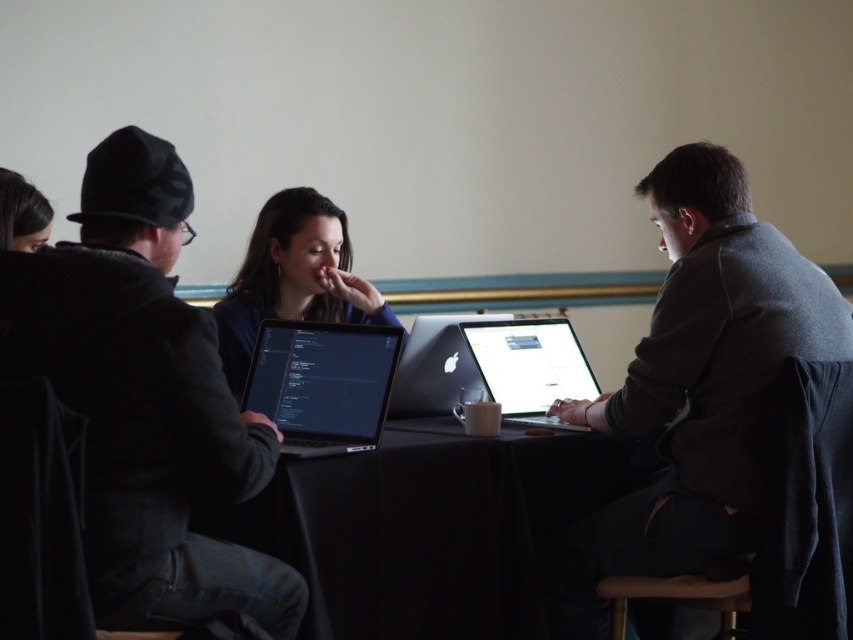
Does matte black jacket at left have a lesser width compared to black fabric table at center?

Indeed, matte black jacket at left has a lesser width compared to black fabric table at center.

Who is more distant from viewer, (109, 323) or (416, 433)?

Point (416, 433)

Image resolution: width=853 pixels, height=640 pixels. What are the coordinates of `matte black jacket at left` in the screenshot? It's located at (144, 400).

Which is behind, point (158, 416) or point (459, 314)?

Point (459, 314)

Is point (136, 499) positioned after point (456, 365)?

No, (136, 499) is in front of (456, 365).

Find the location of a particular element. matte black jacket at left is located at coordinates (144, 400).

Which is behind, point (410, 449) or point (315, 227)?

The point (315, 227) is more distant.

Is black fabric table at center below matte black laptop at center?

Correct, black fabric table at center is located below matte black laptop at center.

Who is more forward, (447,620) or (254,340)?

Point (447,620) is more forward.

At what (x,y) coordinates should I click in order to perform the action: click on black fabric table at center. Please return your answer as a coordinate pair (x, y). The height and width of the screenshot is (640, 853). Looking at the image, I should click on (431, 529).